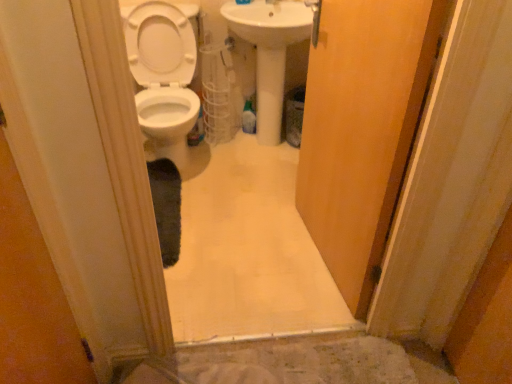
Find the location of a particular element. Image resolution: width=512 pixels, height=384 pixels. free spot behind wooden door at center is located at coordinates (264, 193).